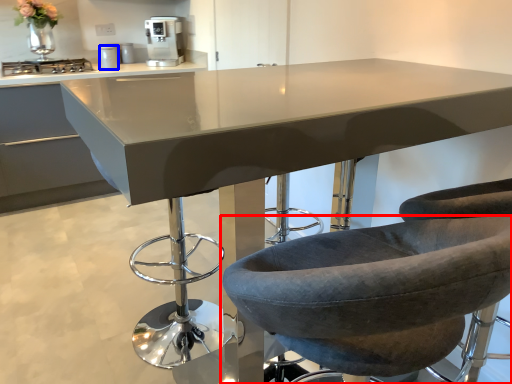
Question: Which of the following is the farthest to the observer, chair (highlighted by a red box) or appliance (highlighted by a blue box)?

Choices:
 (A) chair
 (B) appliance

Answer: (B)